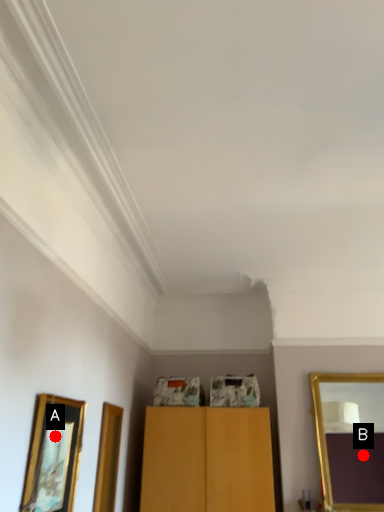
Question: Two points are circled on the image, labeled by A and B beside each circle. Which point is closer to the camera taking this photo?

Choices:
 (A) A is closer
 (B) B is closer

Answer: (A)